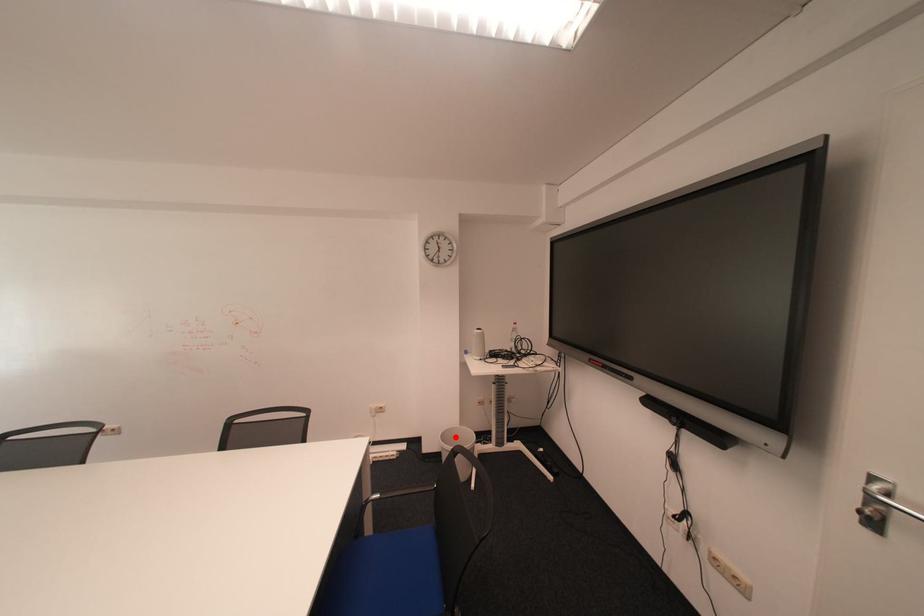
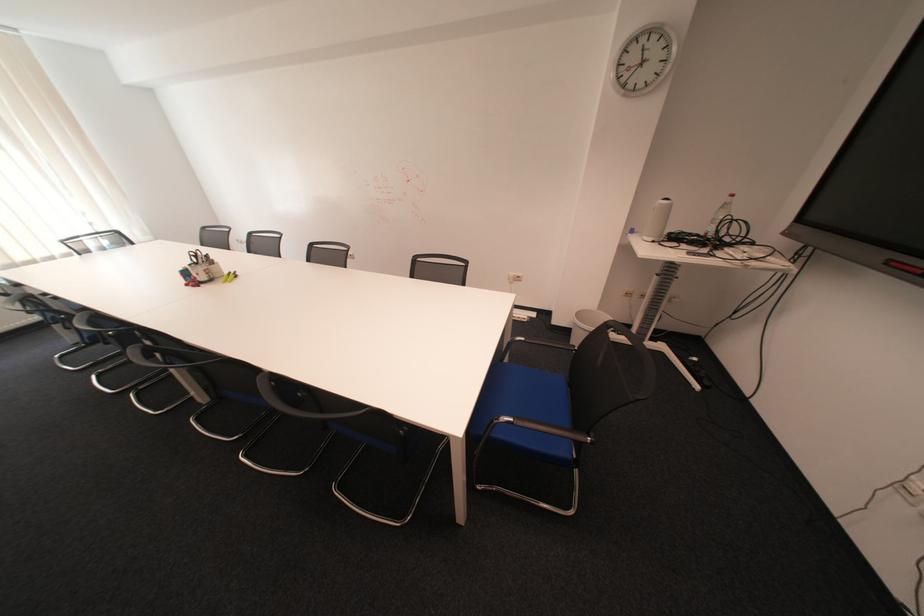
The point at the highlighted location is marked in the first image. Where is the corresponding point in the second image?

(590, 315)